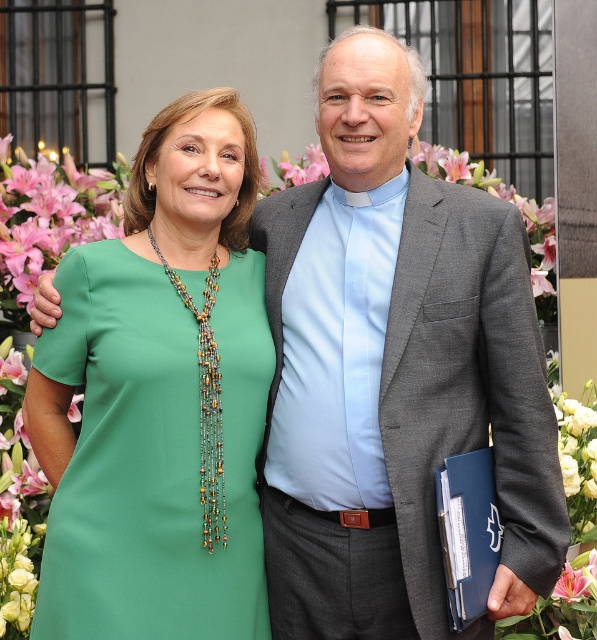
Does green fabric dress at center appear on the left side of blue leather folder at right?

Yes, green fabric dress at center is to the left of blue leather folder at right.

Which is below, green fabric dress at center or blue leather folder at right?

blue leather folder at right

Find the location of `green fabric dress at center`. green fabric dress at center is located at coordinates tap(152, 452).

Where is `green fabric dress at center`? The width and height of the screenshot is (597, 640). green fabric dress at center is located at coordinates (152, 452).